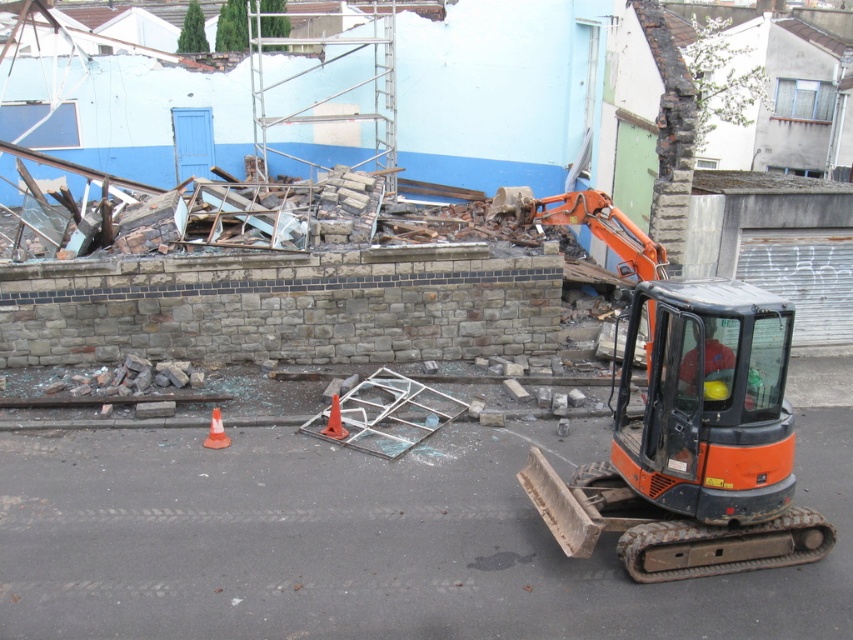
You are standing at the origin point in the image and want to move towards the point at the coordinates point (666,426). However, there is an obstacle at point (723,321). Will you encounter the obstacle before reaching your destination?

Yes, you will encounter the obstacle at point (723,321) before reaching point (666,426) because point (666,426) is behind point (723,321).

You are a construction worker standing near the orange metallic excavator at center and the orange plastic cone at center. You need to place a safety barrier between them. Which object should the barrier be closer to to ensure it is between both?

The orange metallic excavator at center is closer to the viewer than the orange plastic cone at center, so the barrier should be placed closer to the orange plastic cone at center to be between them.

You are a safety inspector at the construction site. You notice an orange metallic excavator at center and an orange hard hat at center. According to safety protocols, which object should be placed higher to ensure the hard hat is not at risk of falling onto the excavator?

The orange metallic excavator at center should be positioned lower than the orange hard hat at center to prevent the hard hat from falling onto it. However, according to the description, the orange metallic excavator at center is already positioned under the orange hard hat at center, which aligns with safety protocols to keep the hard hat above the excavator.